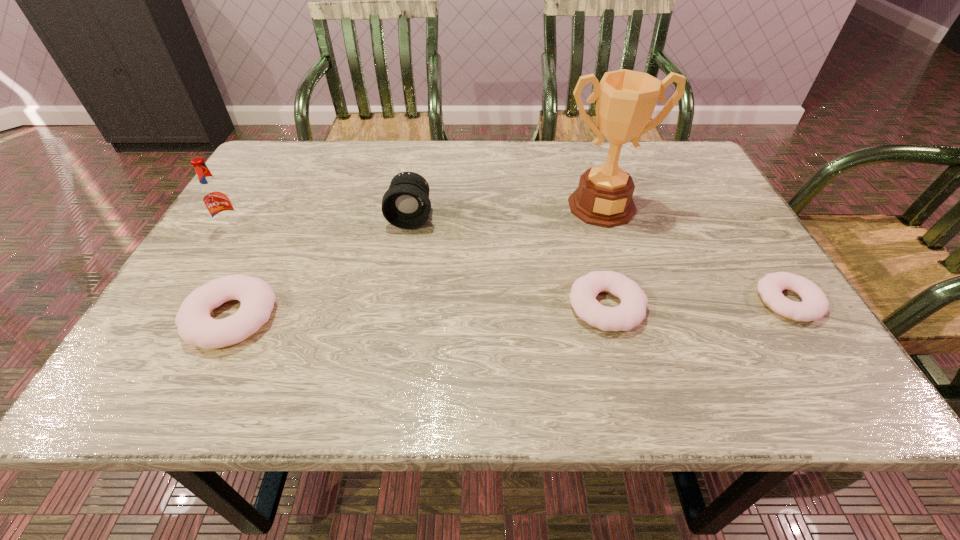
I want to click on free space located on the back of the second doughnut from left to right, so click(575, 186).

This screenshot has width=960, height=540. Identify the location of blank area located on the left of the rightmost object. (642, 301).

This screenshot has height=540, width=960. I want to click on vacant point located 0.050m on the front-facing side of the tallest object, so click(612, 242).

At what (x,y) coordinates should I click in order to perform the action: click on vacant space located at the front element of the third tallest object. Please return your answer as a coordinate pair (x, y). Looking at the image, I should click on (393, 318).

Identify the location of free space located on the front of the second tallest object. (194, 291).

The height and width of the screenshot is (540, 960). In order to click on object that is at the far edge in this screenshot , I will do `click(626, 99)`.

Locate an element on the screen. doughnut positioned at the left edge is located at coordinates (196, 327).

In order to click on root beer that is at the left edge in this screenshot , I will do `click(215, 197)`.

What are the coordinates of `object present at the right edge` in the screenshot? It's located at (814, 305).

Where is `object situated at the near left corner`? object situated at the near left corner is located at coordinates (196, 327).